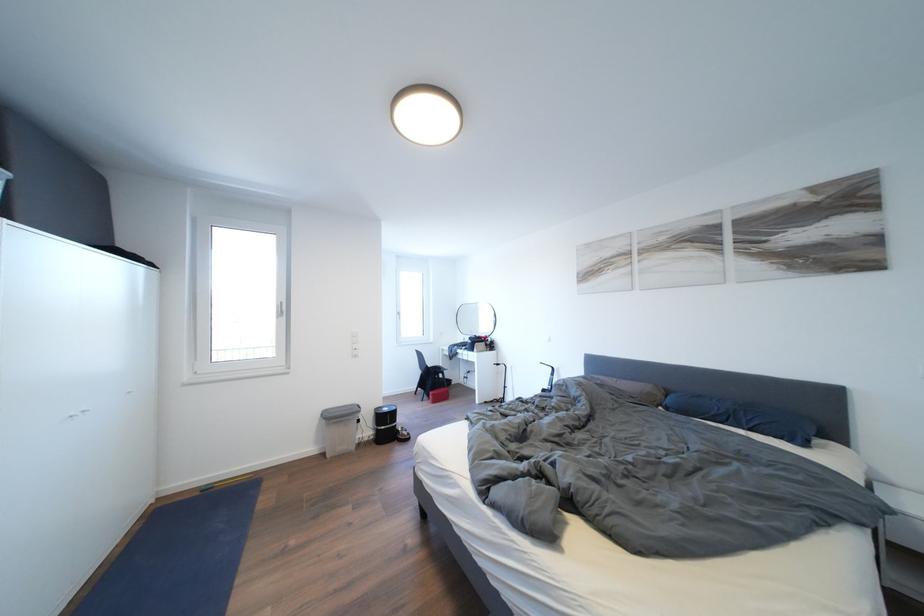
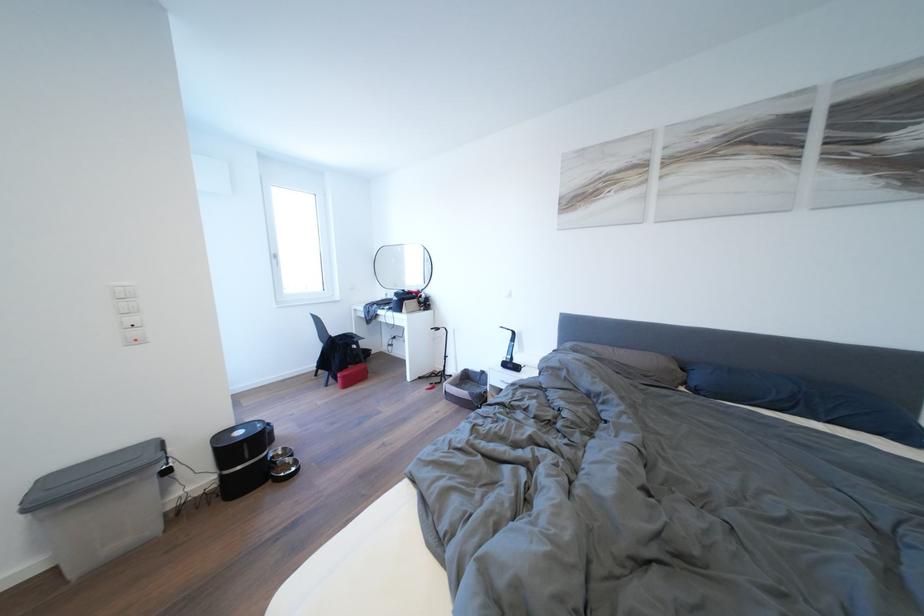
Where in the second image is the point corresponding to [440,395] from the first image?

(348, 376)